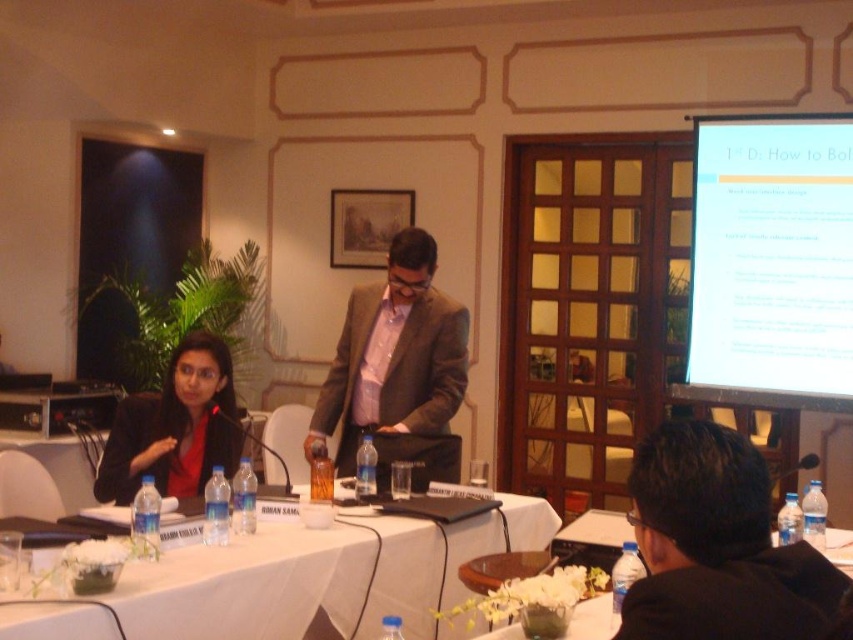
You are a guest entering the room and need to sit down. There is a white cloth table at center and a brown textured suit at center. Which object should you avoid sitting on to maintain proper etiquette?

You should avoid sitting on the brown textured suit at center because it is likely a suit belonging to someone else and sitting on the white cloth table at center is not appropriate as tables are for placing items, not sitting.

You are organizing a formal event and need to seat guests based on their attire. You have two guests wearing the black suit at lower right and the brown textured suit at center. Which guest should you seat closer to the front of the room if taller guests are preferred for visibility?

The brown textured suit at center should be seated closer to the front because it is taller than the black suit at lower right, ensuring better visibility for taller guests.

You are organizing a meeting and need to place a 1.2 meter wide banner between the white cloth table at center and the brown textured suit at center. Can the banner fit between them?

The white cloth table at center might be wider than brown textured suit at center, so the banner might not fit if the distance between them is less than 1.2 meters. Check the actual space available.